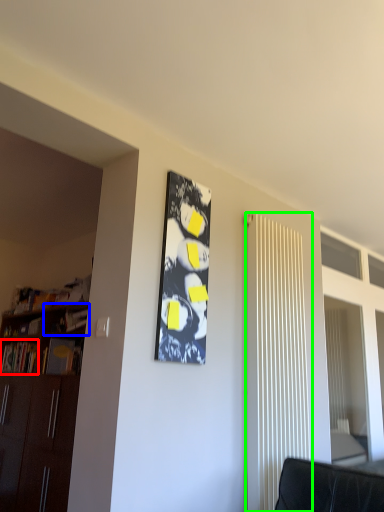
Question: Which object is positioned farthest from book (highlighted by a red box)? Select from shelf (highlighted by a blue box) and radiator (highlighted by a green box).

Choices:
 (A) shelf
 (B) radiator

Answer: (B)